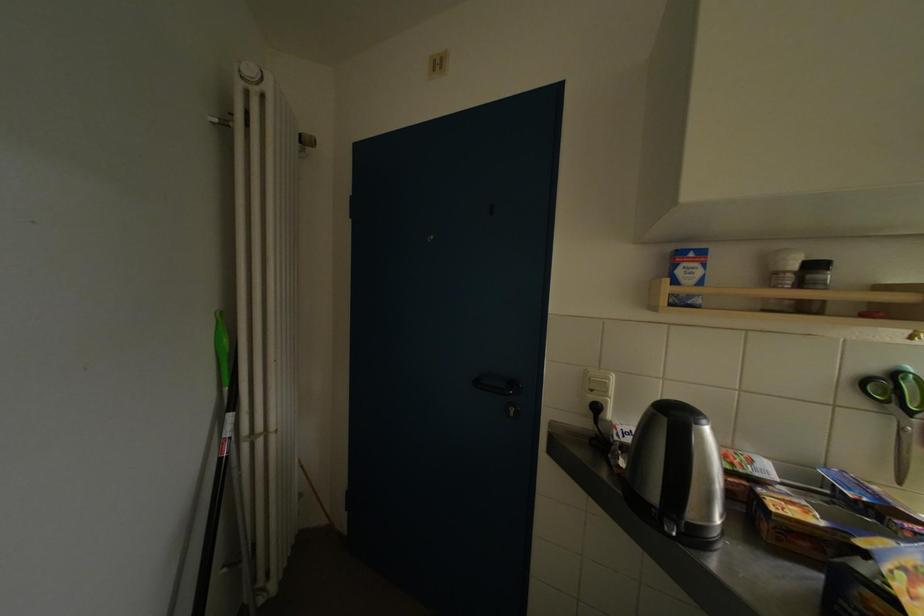
The width and height of the screenshot is (924, 616). Describe the element at coordinates (782, 277) in the screenshot. I see `the salt shaker` at that location.